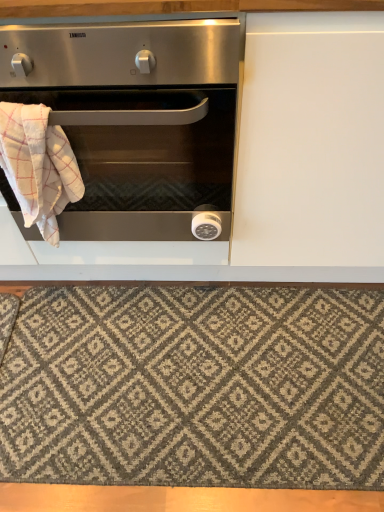
Question: Is the depth of stainless steel oven at left less than that of textured gray rug at lower center?

Choices:
 (A) no
 (B) yes

Answer: (B)

Question: From a real-world perspective, is stainless steel oven at left positioned under textured gray rug at lower center based on gravity?

Choices:
 (A) no
 (B) yes

Answer: (A)

Question: Does stainless steel oven at left appear on the right side of textured gray rug at lower center?

Choices:
 (A) no
 (B) yes

Answer: (A)

Question: Can you confirm if stainless steel oven at left is smaller than textured gray rug at lower center?

Choices:
 (A) no
 (B) yes

Answer: (A)

Question: Does stainless steel oven at left contain textured gray rug at lower center?

Choices:
 (A) no
 (B) yes

Answer: (A)

Question: Is stainless steel oven at left not within textured gray rug at lower center?

Choices:
 (A) yes
 (B) no

Answer: (A)

Question: Does white checkered towel at left have a larger size compared to textured gray rug at lower center?

Choices:
 (A) yes
 (B) no

Answer: (B)

Question: Considering the relative positions of white checkered towel at left and textured gray rug at lower center in the image provided, is white checkered towel at left behind textured gray rug at lower center?

Choices:
 (A) yes
 (B) no

Answer: (B)

Question: From the image's perspective, would you say white checkered towel at left is shown under textured gray rug at lower center?

Choices:
 (A) no
 (B) yes

Answer: (A)

Question: Does white checkered towel at left appear on the right side of textured gray rug at lower center?

Choices:
 (A) yes
 (B) no

Answer: (B)

Question: From a real-world perspective, is white checkered towel at left under textured gray rug at lower center?

Choices:
 (A) yes
 (B) no

Answer: (B)

Question: Does white checkered towel at left have a greater height compared to textured gray rug at lower center?

Choices:
 (A) yes
 (B) no

Answer: (A)

Question: From the image's perspective, would you say textured gray rug at lower center is positioned over white checkered towel at left?

Choices:
 (A) yes
 (B) no

Answer: (B)